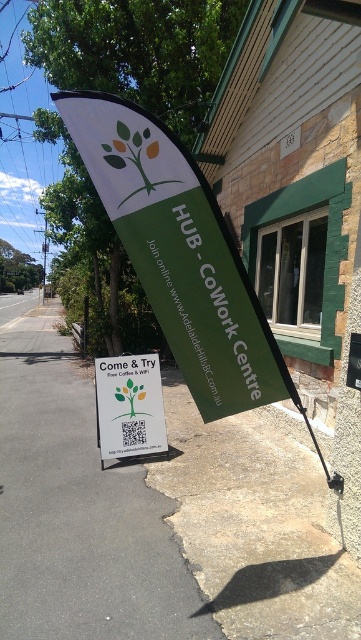
Consider the image. You are a delivery person trying to park your van near the gray concrete pavement at center and the white paper sign at center. Since you need to know which area is larger to fit your van, can you tell me which one is bigger?

The gray concrete pavement at center is bigger than the white paper sign at center, so the van can park on the gray concrete pavement at center.